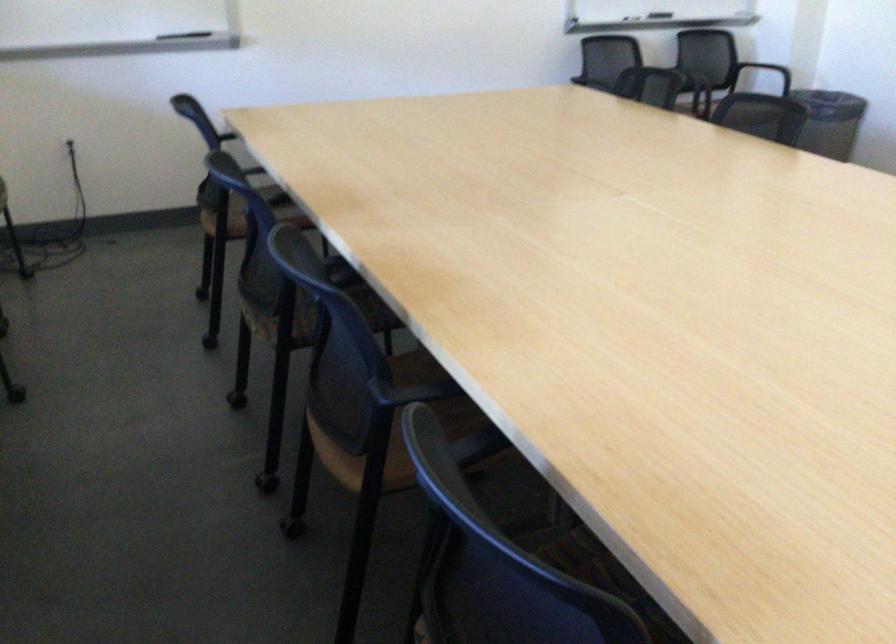
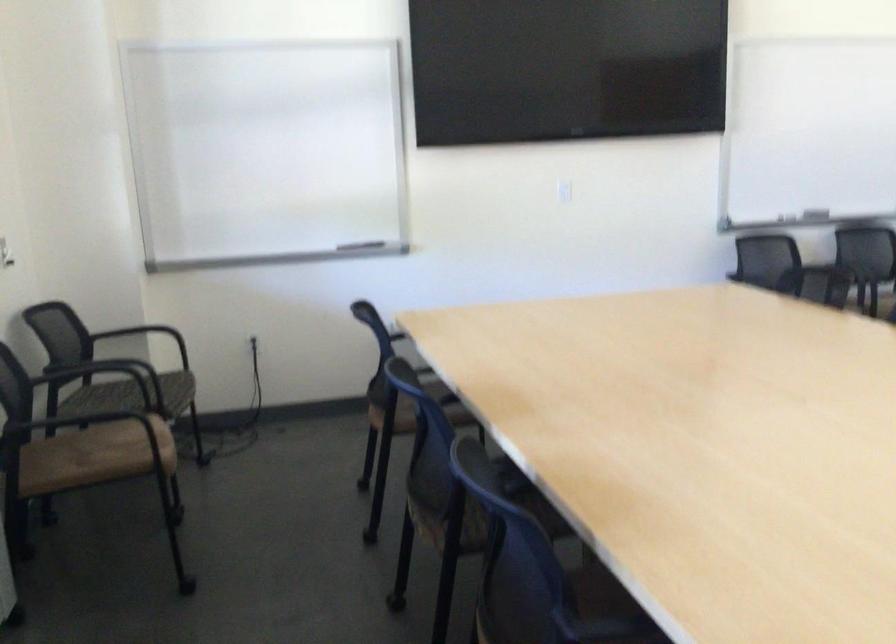
Question: In a continuous first-person perspective shot, in which direction is the camera moving?

Choices:
 (A) Left
 (B) Right
 (C) Forward
 (D) Backward

Answer: (A)